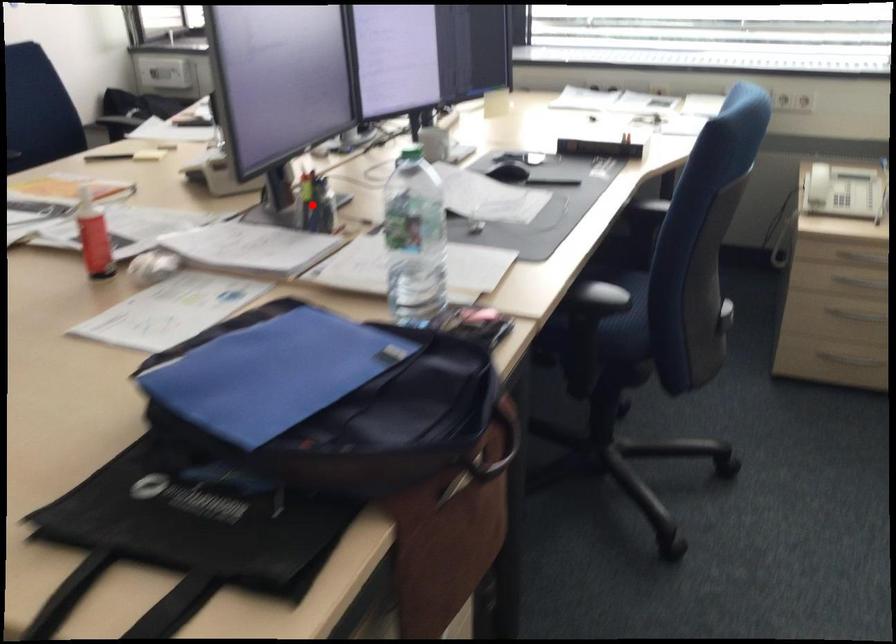
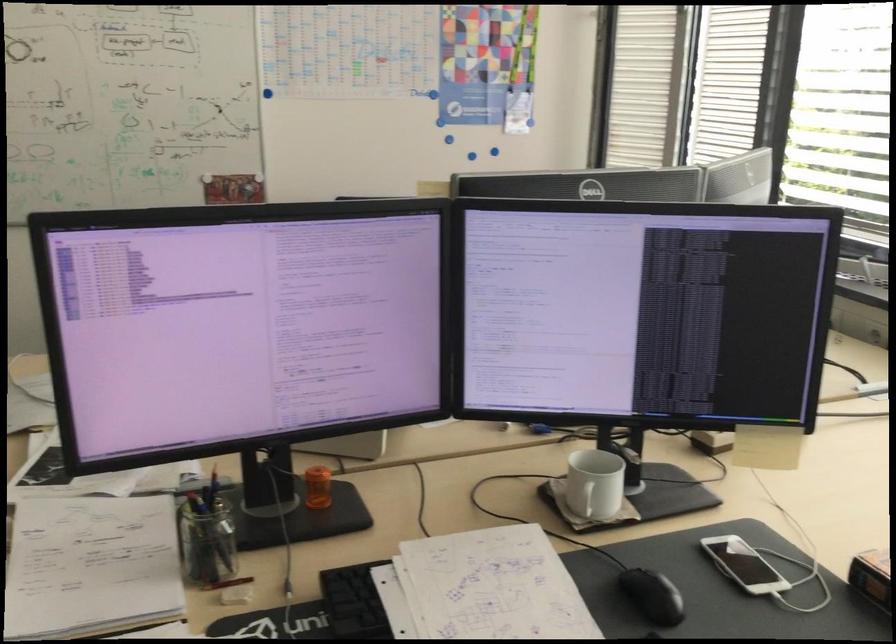
Locate, in the second image, the point that corresponds to the highlighted location in the first image.

(205, 538)